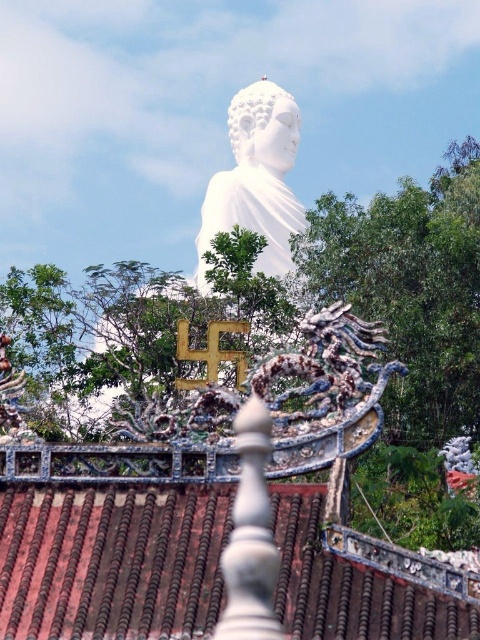
You are a tourist standing in front of the white marble statue at center and the brown tile roof at center. Which object is located below the other?

The brown tile roof at center is positioned under the white marble statue at center.